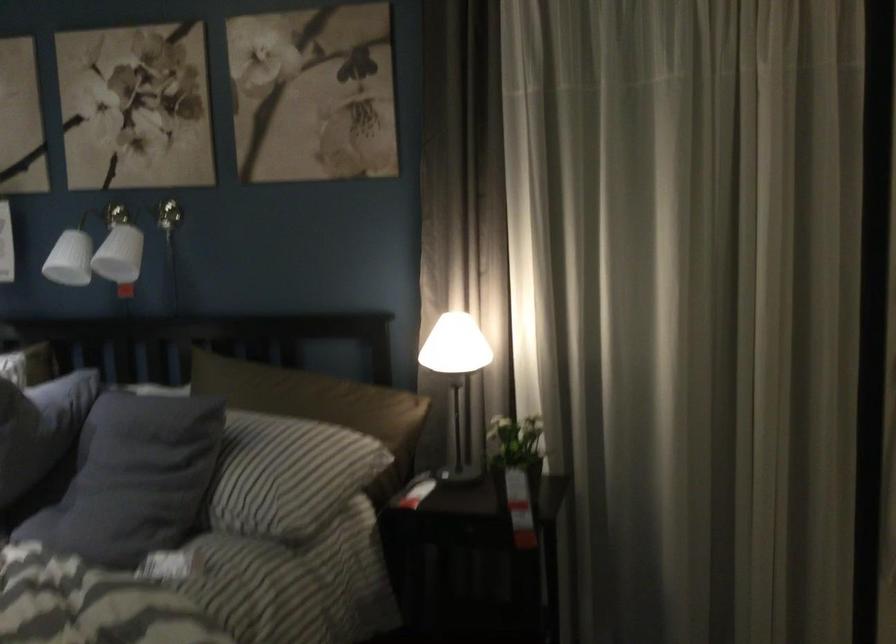
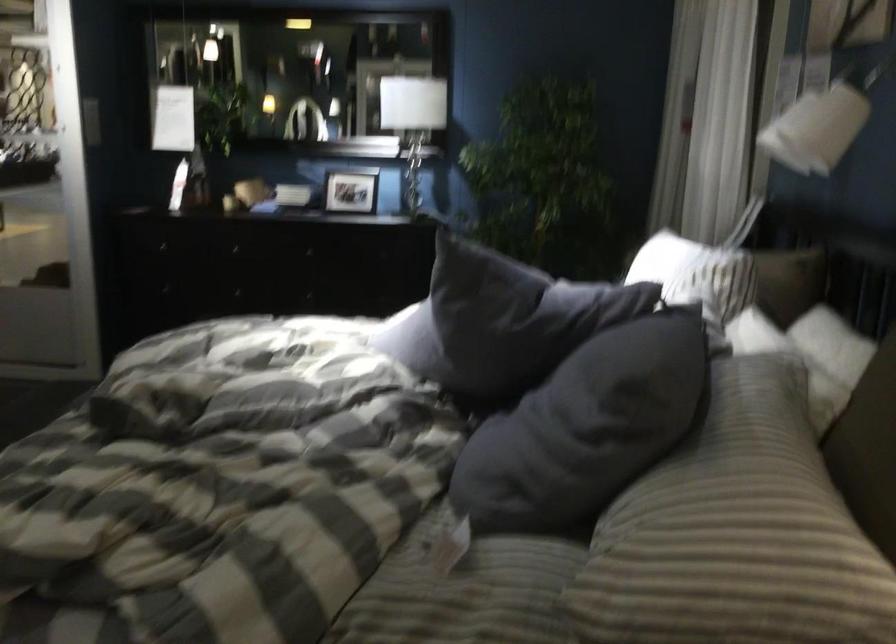
Locate, in the second image, the point that corresponds to point 273,428 in the first image.

(760, 453)